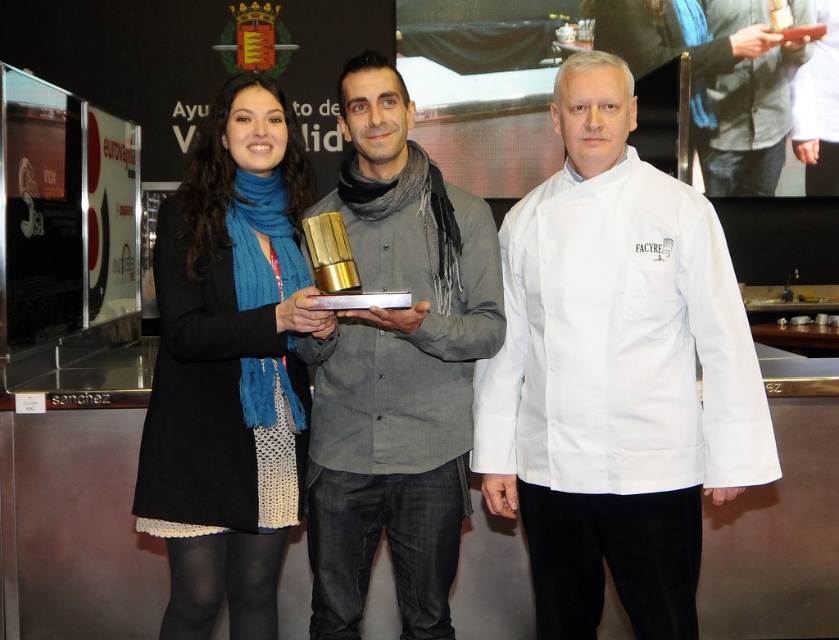
You are standing at the back of the room and want to hand the trophy to the chef in the center. Which object is closer to you, the matte gold trophy at center or the black wool coat at left?

The matte gold trophy at center is closer to you than the black wool coat at left.

You are a photographer at this event and need to adjust the lighting between the white fabric chef coat at center and the black wool coat at left. The minimum distance required for your equipment to function properly is 27 inches. Based on the scene, will your equipment work between these two coats?

The distance between the white fabric chef coat at center and the black wool coat at left is 26.97 inches, which is just below the 27 inches minimum requirement. Therefore, the equipment may not function properly at this distance.

You are a photographer at this event and need to ensure that the matte gold trophy at center and the white fabric chef coat at center are clearly visible in the photo. Given that the minimum focus distance for your camera is 3 inches, will you need to adjust your camera settings to capture both items in focus?

The matte gold trophy at center is 2.91 inches from the white fabric chef coat at center, which is less than the minimum focus distance of 3 inches. Therefore, you will need to adjust your camera settings to ensure both items are in focus.